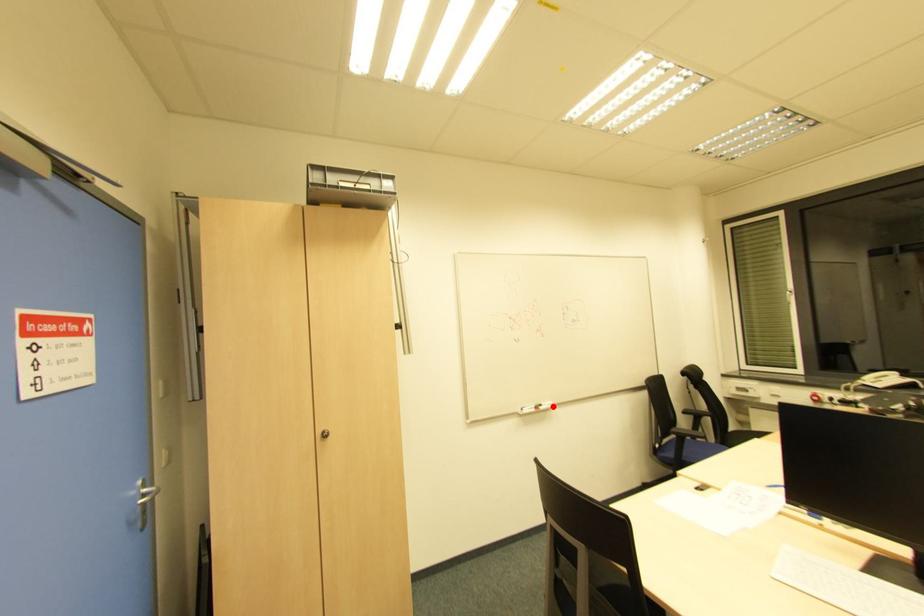
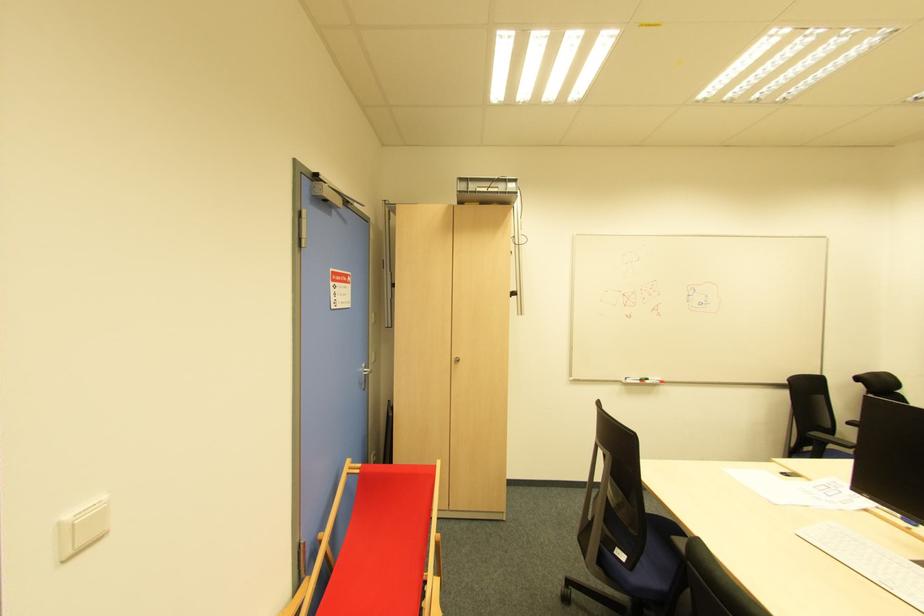
The point at the highlighted location is marked in the first image. Where is the corresponding point in the second image?

(662, 383)